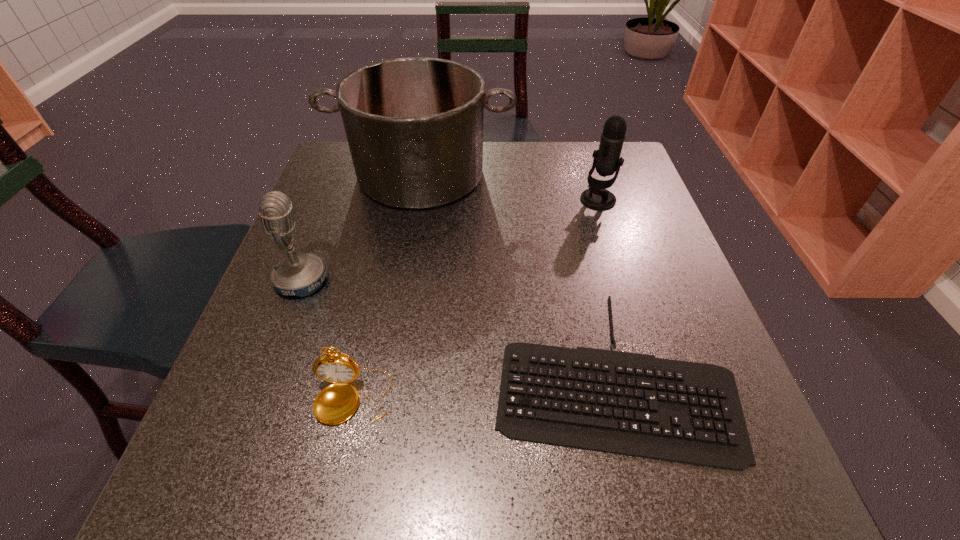
Identify the location of vacant point located between the farther microphone and the left microphone. (450, 240).

Locate an element on the screen. The width and height of the screenshot is (960, 540). vacant point located between the second shortest object and the pan is located at coordinates (387, 286).

Locate an element on the screen. The height and width of the screenshot is (540, 960). free spot between the right microphone and the shortest object is located at coordinates (604, 285).

Identify the location of vacant point located between the shortest object and the farther microphone. The height and width of the screenshot is (540, 960). (604, 285).

This screenshot has height=540, width=960. I want to click on free space between the pan and the right microphone, so click(510, 187).

Locate an element on the screen. This screenshot has height=540, width=960. vacant space in between the right microphone and the shortest object is located at coordinates (604, 285).

Locate an element on the screen. The width and height of the screenshot is (960, 540). object that stands as the fourth closest to the right microphone is located at coordinates (336, 403).

Identify which object is the fourth nearest to the nearer microphone. Please provide its 2D coordinates. Your answer should be formatted as a tuple, i.e. [(x, y)], where the tuple contains the x and y coordinates of a point satisfying the conditions above.

[(607, 160)]

This screenshot has height=540, width=960. Identify the location of vacant space that satisfies the following two spatial constraints: 1. on the front-facing side of the left microphone; 2. on the left side of the computer keyboard. (266, 371).

This screenshot has height=540, width=960. In order to click on vacant region that satisfies the following two spatial constraints: 1. on the front-facing side of the nearer microphone; 2. on the back side of the shortest object in this screenshot , I will do `click(266, 371)`.